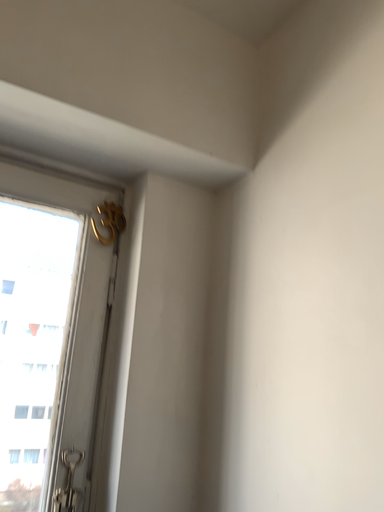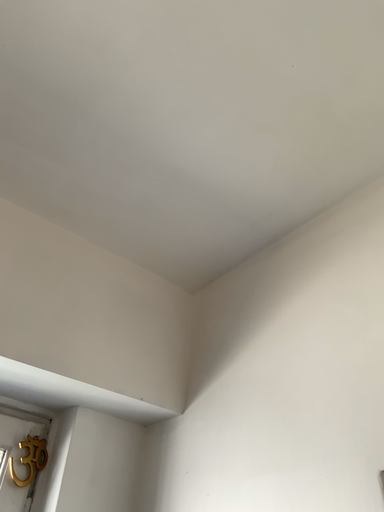
Question: How did the camera likely rotate when shooting the video?

Choices:
 (A) rotated left
 (B) rotated right

Answer: (B)